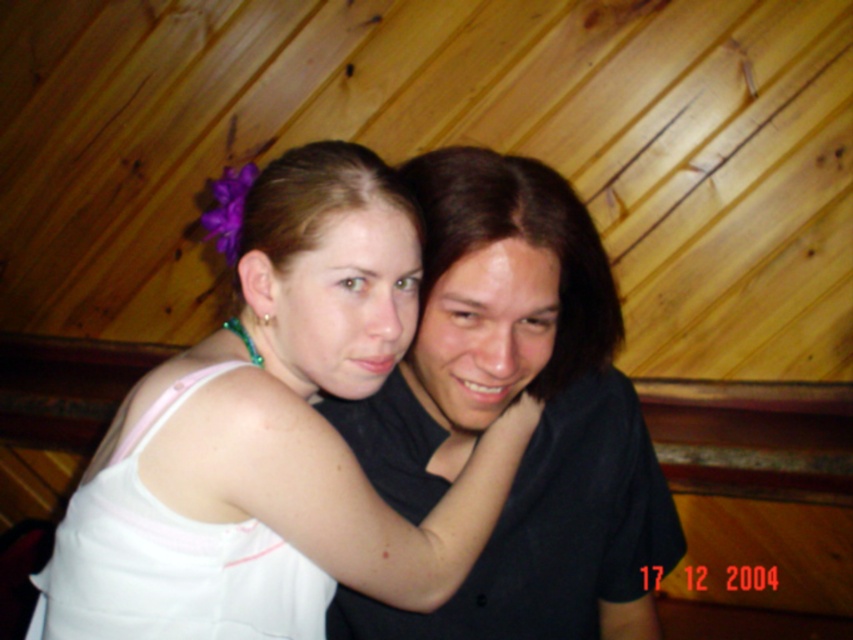
Can you confirm if white fabric at center is positioned to the right of black matte shirt at center?

No, white fabric at center is not to the right of black matte shirt at center.

Who is higher up, white fabric at center or black matte shirt at center?

black matte shirt at center

Find the location of a particular element. white fabric at center is located at coordinates tap(271, 440).